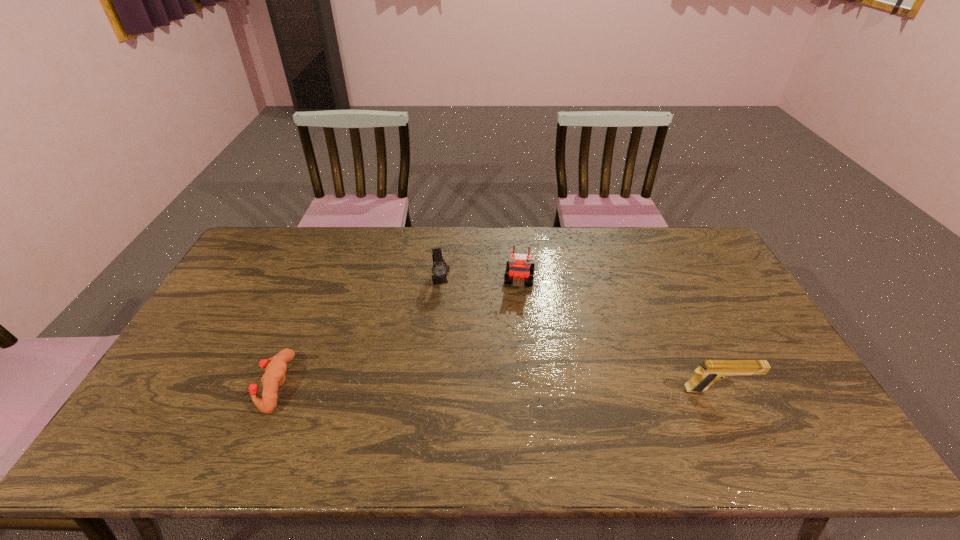
Where is `blank area located on the front-facing side of the Lego`? blank area located on the front-facing side of the Lego is located at coordinates (516, 313).

You are a GUI agent. You are given a task and a screenshot of the screen. Output one action in this format:
    pyautogui.click(x=<x>, y=<y>)
    Task: Click on the free spot located 0.180m on the front-facing side of the Lego
    The image size is (960, 540).
    Given the screenshot: What is the action you would take?
    pyautogui.click(x=514, y=333)

This screenshot has width=960, height=540. What are the coordinates of `vacant space located on the face of the watch` in the screenshot? It's located at (448, 310).

This screenshot has height=540, width=960. I want to click on vacant space located on the face of the watch, so click(468, 388).

Locate an element on the screen. Image resolution: width=960 pixels, height=540 pixels. free space located 0.180m on the face of the watch is located at coordinates (452, 329).

Where is `object at the far edge`? Image resolution: width=960 pixels, height=540 pixels. object at the far edge is located at coordinates (519, 267).

Where is `puncher present at the near edge`? This screenshot has height=540, width=960. puncher present at the near edge is located at coordinates (273, 378).

Locate an element on the screen. Image resolution: width=960 pixels, height=540 pixels. pistol present at the near edge is located at coordinates coord(710,371).

Where is `object that is positioned at the right edge`? This screenshot has width=960, height=540. object that is positioned at the right edge is located at coordinates (710, 371).

Where is `object situated at the near right corner`? This screenshot has width=960, height=540. object situated at the near right corner is located at coordinates (710, 371).